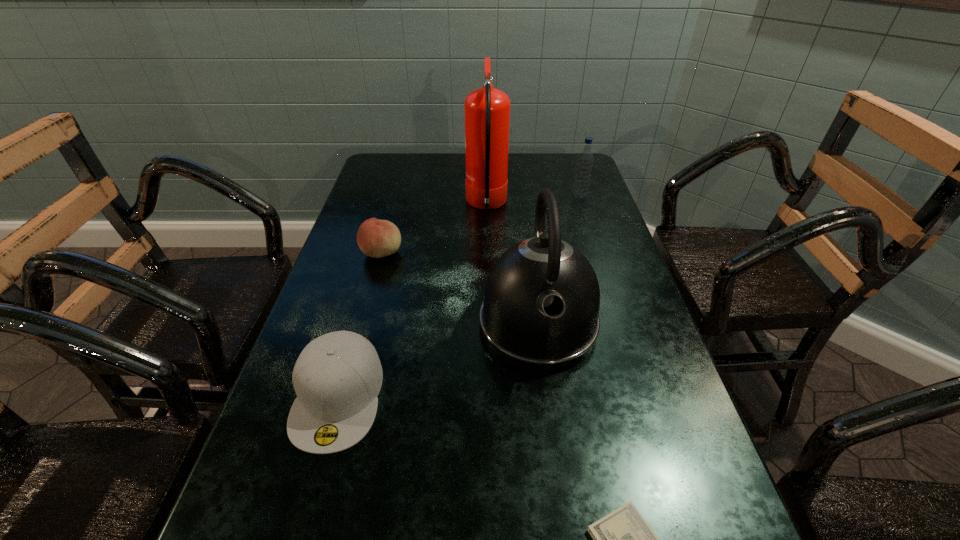
At what (x,y) coordinates should I click in order to perform the action: click on fire extinguisher. Please return your answer as a coordinate pair (x, y). Looking at the image, I should click on (487, 110).

Locate an element on the screen. The width and height of the screenshot is (960, 540). the second tallest object is located at coordinates (540, 311).

Find the location of a particular element. The width and height of the screenshot is (960, 540). water bottle is located at coordinates (585, 160).

The width and height of the screenshot is (960, 540). In order to click on cap in this screenshot , I will do `click(337, 377)`.

I want to click on the fourth nearest object, so click(x=376, y=238).

Identify the location of vacant space situated towards the nozzle of the tallest object. (385, 205).

Locate an element on the screen. The width and height of the screenshot is (960, 540). blank area located 0.110m towards the nozzle of the tallest object is located at coordinates (x=429, y=205).

Locate an element on the screen. free spot located 0.180m towards the nozzle of the tallest object is located at coordinates (405, 205).

I want to click on vacant space located 0.090m on the spout of the second tallest object, so click(551, 421).

Locate an element on the screen. free spot located on the left of the fourth shortest object is located at coordinates (481, 196).